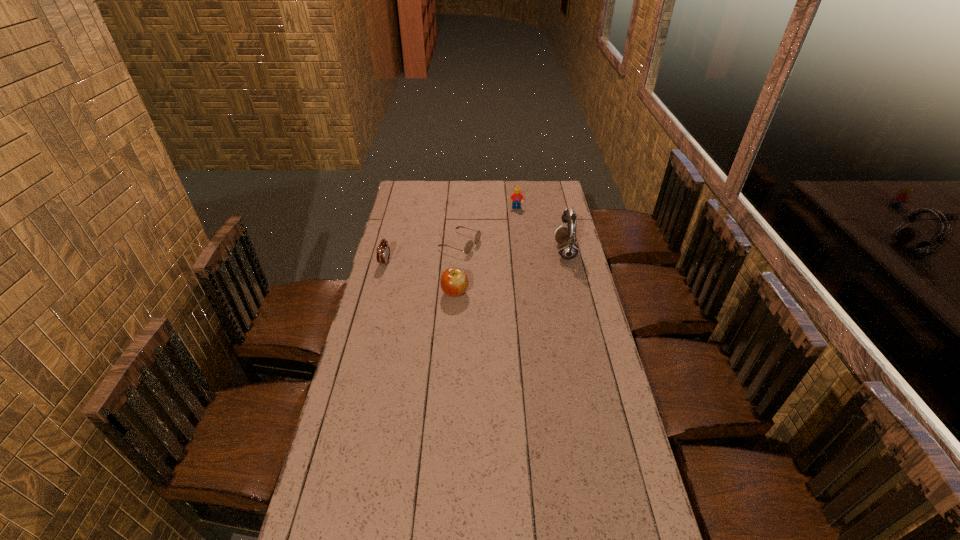
Identify the location of vacant space located on the face of the Lego. This screenshot has height=540, width=960. (516, 247).

Find the location of a particular element. The width and height of the screenshot is (960, 540). vacant space located on the lenses of the sunglasses is located at coordinates (524, 265).

Where is `free region located on the lenses of the sunglasses`? The width and height of the screenshot is (960, 540). free region located on the lenses of the sunglasses is located at coordinates (551, 274).

Identify the location of vacant position located 0.220m on the lenses of the sunglasses. Image resolution: width=960 pixels, height=540 pixels. (522, 264).

The image size is (960, 540). What are the coordinates of `free location located 0.210m on the face of the alarm clock` in the screenshot? It's located at (436, 268).

Identify the location of vacant space positioned 0.190m on the face of the alarm clock. pos(432,268).

Locate an element on the screen. free space located 0.090m on the face of the alarm clock is located at coordinates (410, 266).

Where is `object present at the left edge`? The height and width of the screenshot is (540, 960). object present at the left edge is located at coordinates (383, 250).

Locate an element on the screen. The image size is (960, 540). object that is at the right edge is located at coordinates (568, 249).

The width and height of the screenshot is (960, 540). Identify the location of vacant space at the far edge. (512, 190).